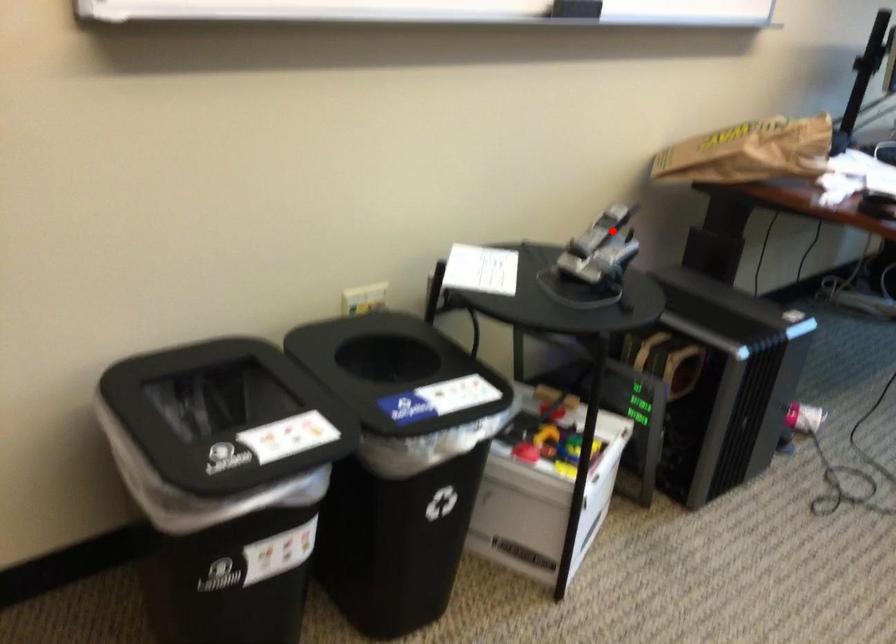
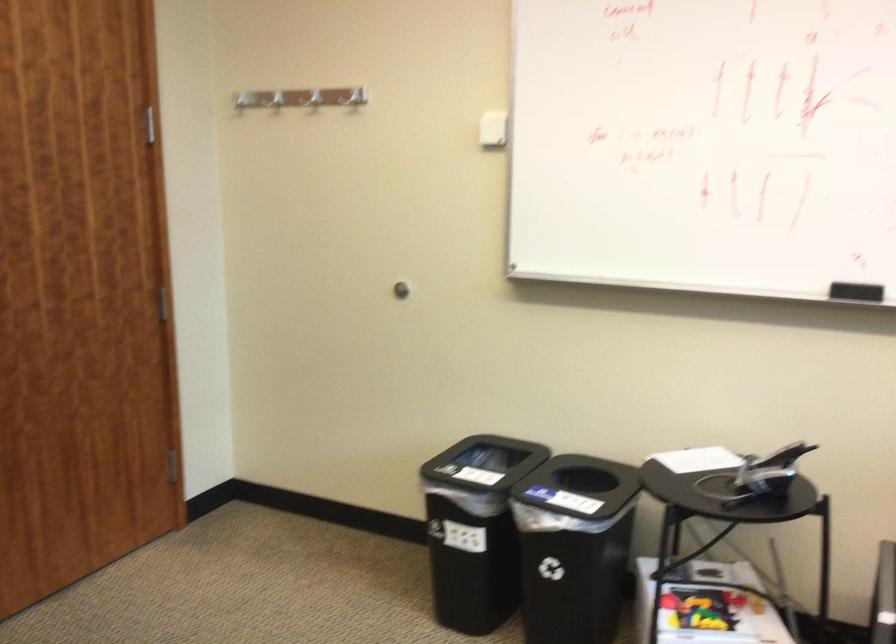
Find the pixel in the second image that matches the highlighted location in the first image.

(782, 456)